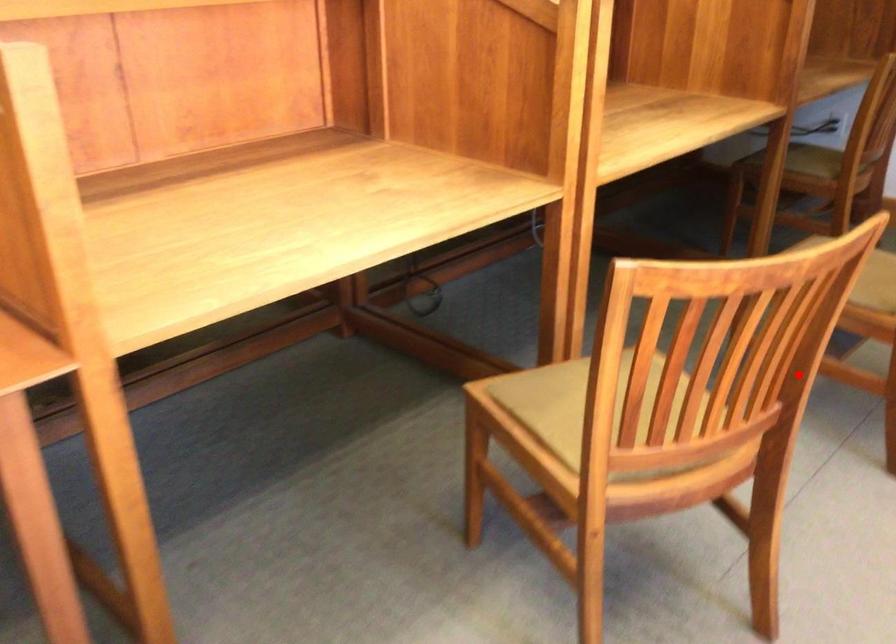
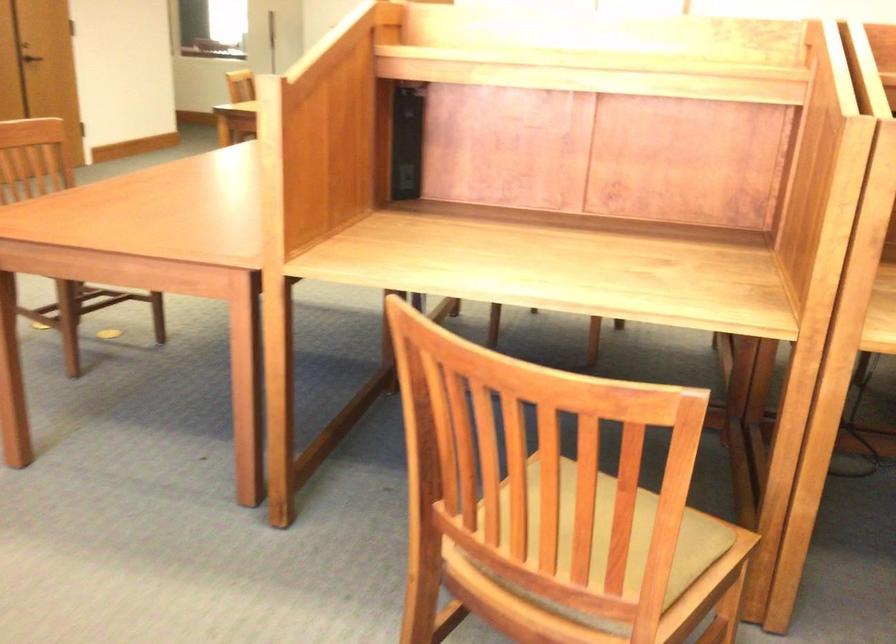
The point at the highlighted location is marked in the first image. Where is the corresponding point in the second image?

(651, 565)